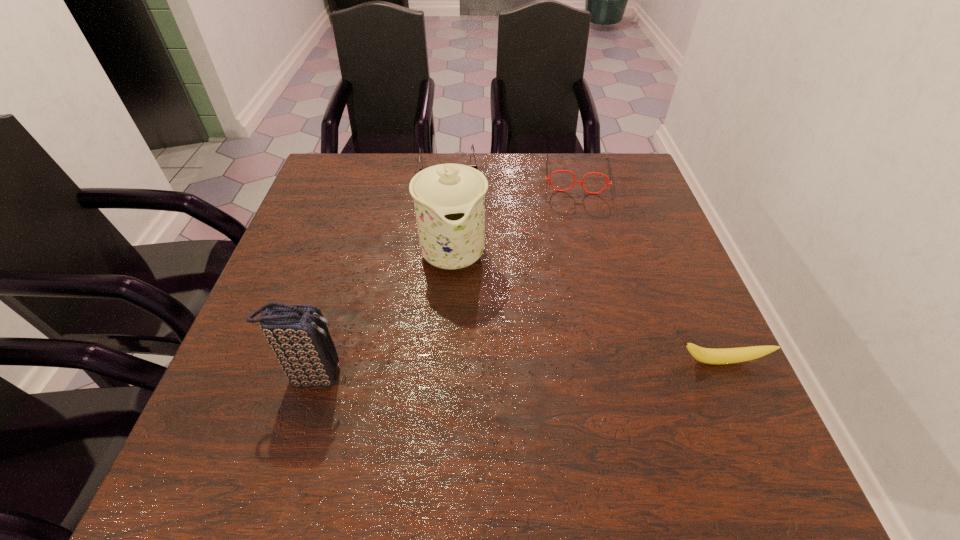
This screenshot has width=960, height=540. I want to click on object that is positioned at the near edge, so click(298, 334).

Where is `object that is at the left edge`? object that is at the left edge is located at coordinates (298, 334).

Identify the location of banana that is at the right edge. (705, 355).

Where is `spectacles positioned at the right edge`? The width and height of the screenshot is (960, 540). spectacles positioned at the right edge is located at coordinates (549, 179).

Image resolution: width=960 pixels, height=540 pixels. I want to click on object that is at the near left corner, so click(x=298, y=334).

I want to click on object present at the far right corner, so click(x=549, y=179).

This screenshot has height=540, width=960. Identify the location of vacant area at the far edge. (476, 158).

At what (x,y) coordinates should I click in order to perform the action: click on free space at the left edge of the desktop. Please return your answer as a coordinate pair (x, y). Image resolution: width=960 pixels, height=540 pixels. Looking at the image, I should click on (340, 246).

The width and height of the screenshot is (960, 540). Identify the location of free space at the right edge of the desktop. (651, 297).

In the image, there is a desktop. Where is `vacant space at the far left corner`? The width and height of the screenshot is (960, 540). vacant space at the far left corner is located at coordinates (364, 188).